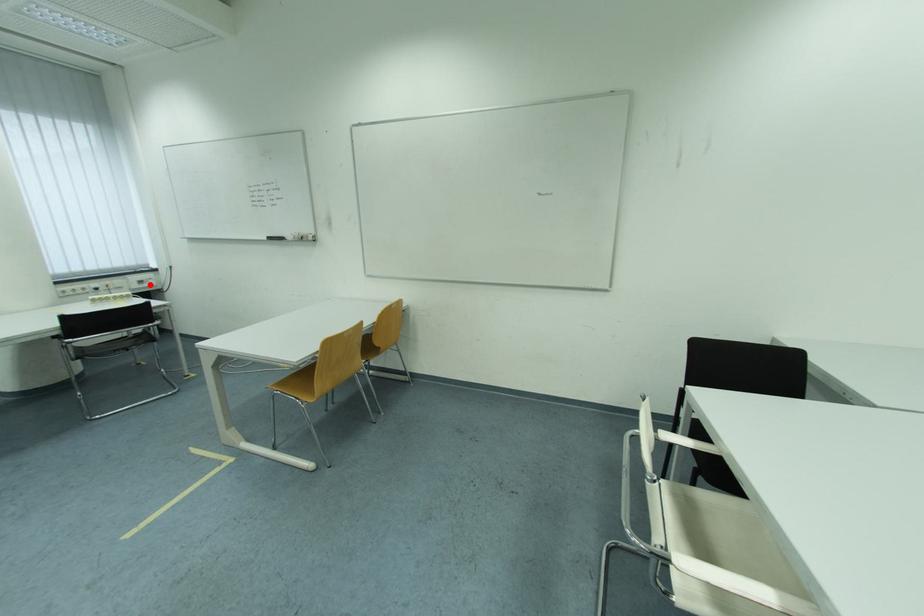
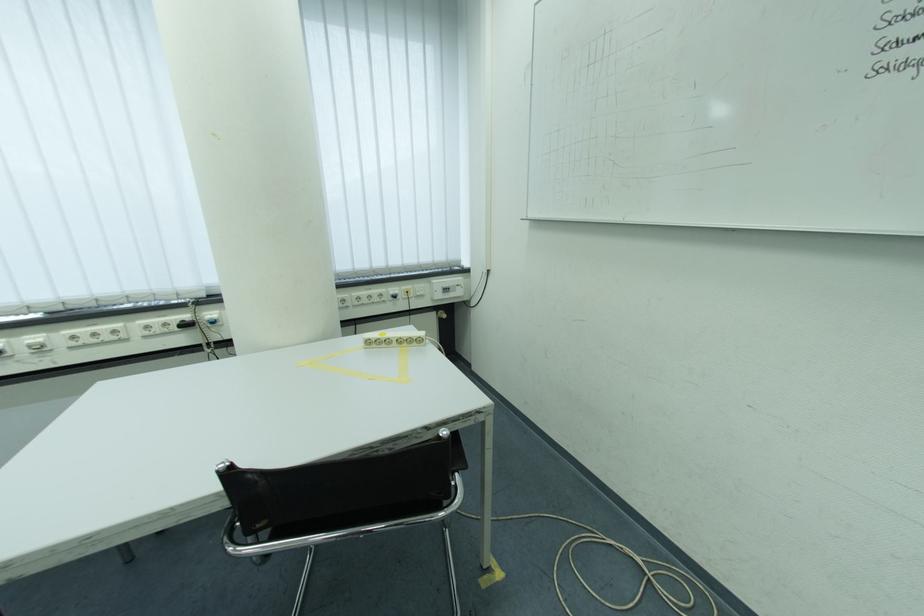
Question: I am providing you with two images of the same scene from different viewpoints. A red point is marked on the first image. Is the red point's position out of view in image 2?

Choices:
 (A) Yes
 (B) No

Answer: (B)